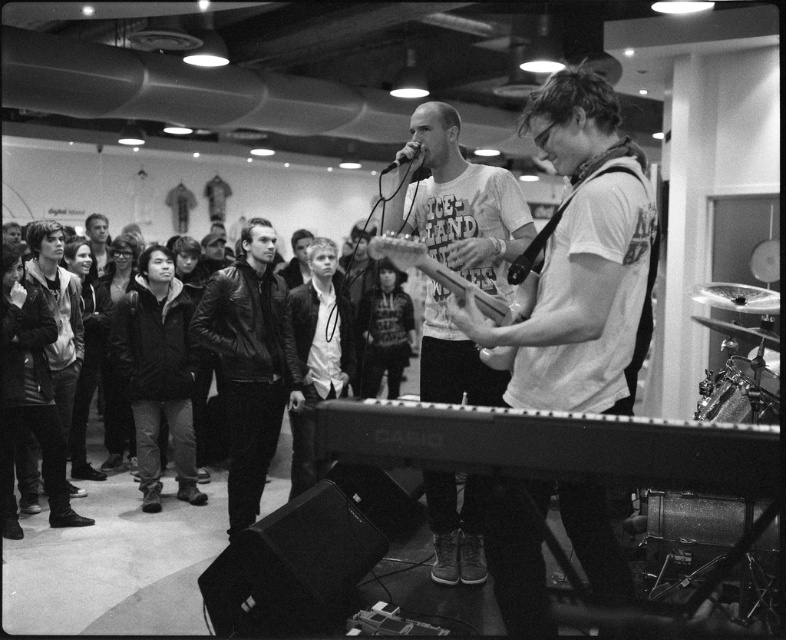
Who is positioned more to the left, metallic silver keyboard at lower center or leather jacket at center?

From the viewer's perspective, leather jacket at center appears more on the left side.

Is metallic silver keyboard at lower center wider than leather jacket at center?

Correct, the width of metallic silver keyboard at lower center exceeds that of leather jacket at center.

This screenshot has height=640, width=786. Describe the element at coordinates (553, 445) in the screenshot. I see `metallic silver keyboard at lower center` at that location.

Identify the location of metallic silver keyboard at lower center. (553, 445).

Is matte white t-shirt at center shorter than metallic silver microphone at upper center?

Incorrect, matte white t-shirt at center's height does not fall short of metallic silver microphone at upper center's.

Who is taller, matte white t-shirt at center or metallic silver microphone at upper center?

matte white t-shirt at center is taller.

Which is behind, point (439, 104) or point (412, 157)?

The point (439, 104) is more distant.

You are a GUI agent. You are given a task and a screenshot of the screen. Output one action in this format:
    pyautogui.click(x=<x>, y=<y>)
    Task: Click on the matte white t-shirt at center
    This screenshot has height=640, width=786.
    Given the screenshot: What is the action you would take?
    pyautogui.click(x=456, y=202)

Can you confirm if white matte guitar at center is positioned below smooth leather jacket at left?

Yes, white matte guitar at center is below smooth leather jacket at left.

Who is more forward, (548, 371) or (107, 234)?

Positioned in front is point (548, 371).

This screenshot has width=786, height=640. Identify the location of white matte guitar at center. (578, 260).